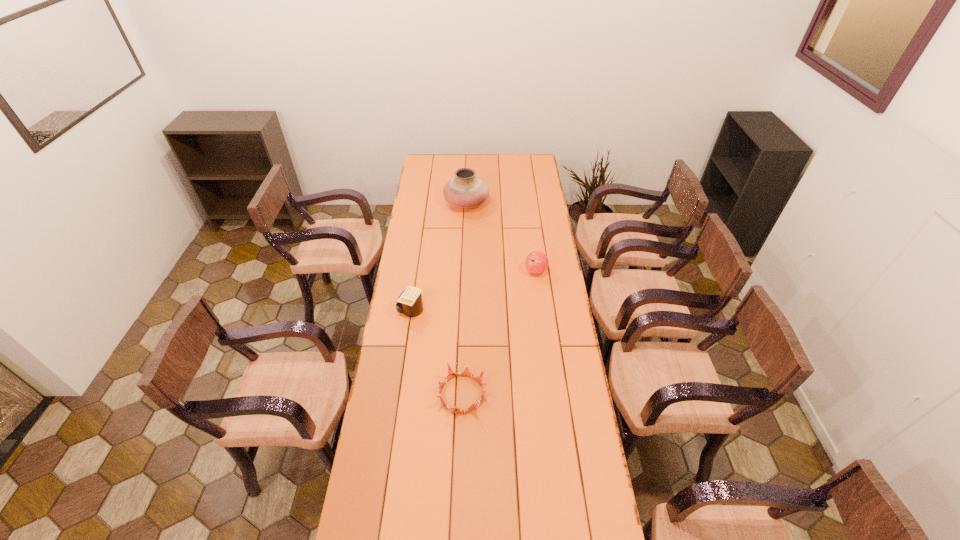
Find the location of a particular element. vacant position in the image that satisfies the following two spatial constraints: 1. on the back side of the calculator; 2. on the right side of the tallest object is located at coordinates (426, 202).